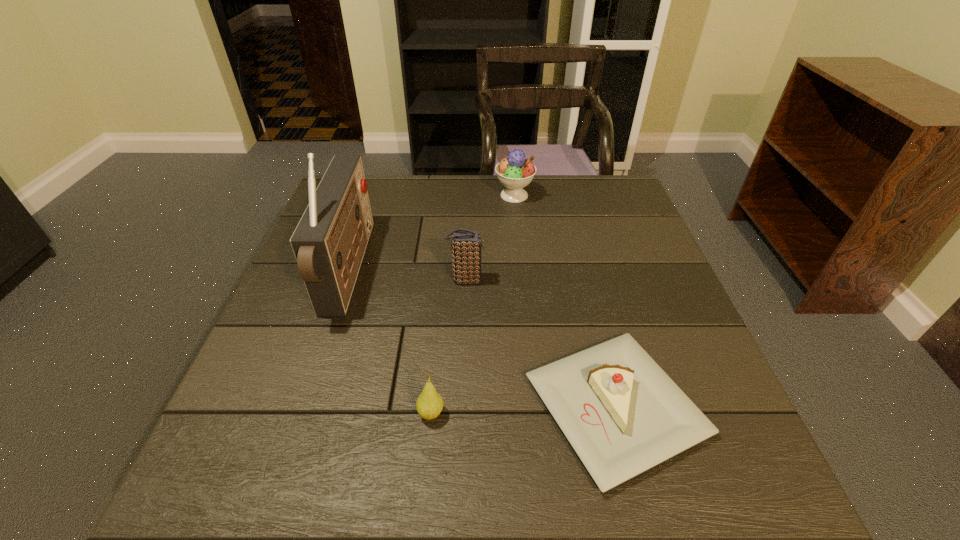
Where is `vacant area between the cake and the clutch bag`? vacant area between the cake and the clutch bag is located at coordinates (540, 343).

Where is `free space between the second shortest object and the radio receiver`? This screenshot has height=540, width=960. free space between the second shortest object and the radio receiver is located at coordinates (390, 342).

The height and width of the screenshot is (540, 960). Find the location of `free space that is in between the shortest object and the clutch bag`. free space that is in between the shortest object and the clutch bag is located at coordinates (540, 343).

Locate an element on the screen. object that is the fourth closest to the leftmost object is located at coordinates (622, 414).

Where is `object identified as the closest to the leftmost object`? This screenshot has width=960, height=540. object identified as the closest to the leftmost object is located at coordinates (466, 245).

The image size is (960, 540). I want to click on vacant region that satisfies the following two spatial constraints: 1. on the front panel of the tallest object; 2. on the back side of the cake, so click(303, 407).

Image resolution: width=960 pixels, height=540 pixels. I want to click on vacant area that satisfies the following two spatial constraints: 1. with the zip open on the clutch bag; 2. on the right side of the shortest object, so click(x=462, y=407).

Where is `free spot that satisfies the following two spatial constraints: 1. with the zip open on the clutch bag; 2. on the right side of the cake`? The width and height of the screenshot is (960, 540). free spot that satisfies the following two spatial constraints: 1. with the zip open on the clutch bag; 2. on the right side of the cake is located at coordinates (462, 407).

Find the location of a particular element. The image size is (960, 540). free spot that satisfies the following two spatial constraints: 1. on the back side of the cake; 2. with the zip open on the clutch bag is located at coordinates (583, 280).